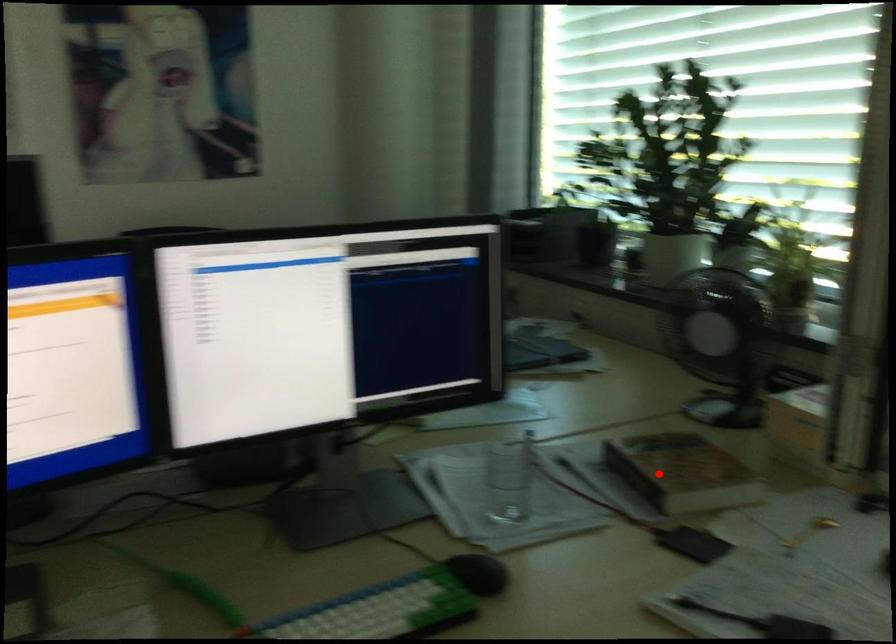
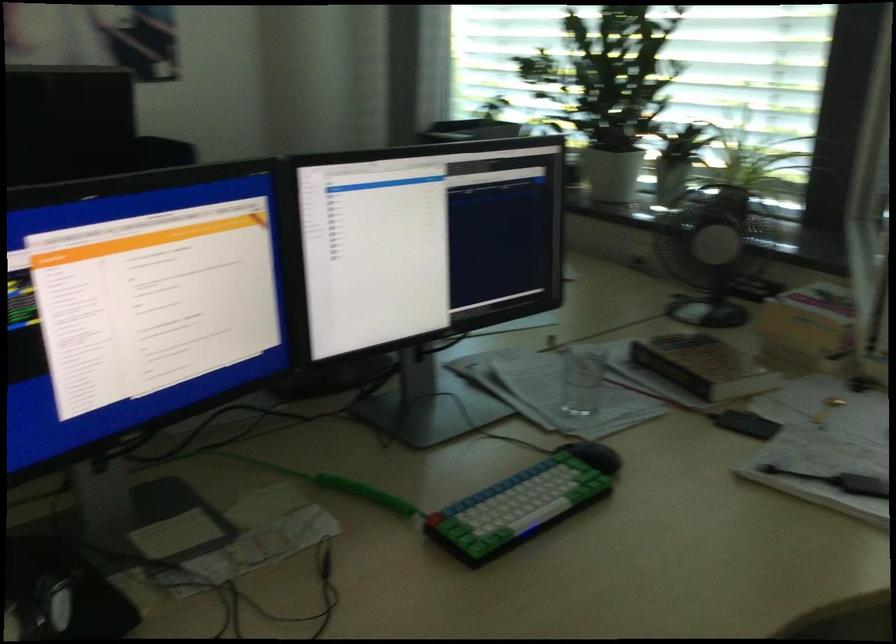
Question: I am providing you with two images of the same scene from different viewpoints. Image1 has a red point marked. In image2, the corresponding 3D location appears at what relative position? Reply with the corresponding letter.

Choices:
 (A) Closer
 (B) Farther

Answer: (B)